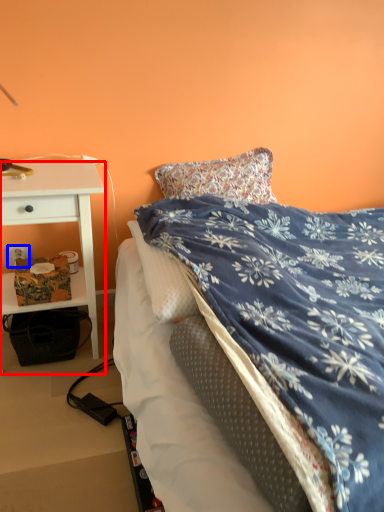
Question: Which object appears farthest to the camera in this image, desk (highlighted by a red box) or power outlet (highlighted by a blue box)?

Choices:
 (A) desk
 (B) power outlet

Answer: (B)